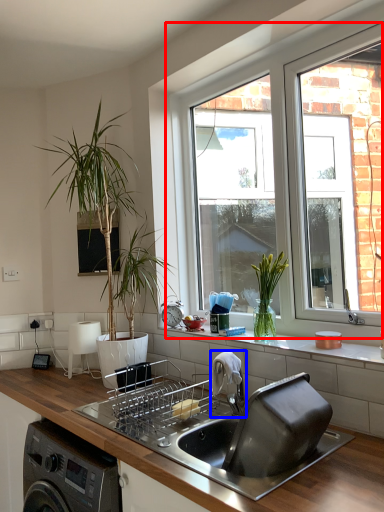
Question: Which point is further to the camera, window (highlighted by a red box) or tap (highlighted by a blue box)?

Choices:
 (A) window
 (B) tap

Answer: (A)